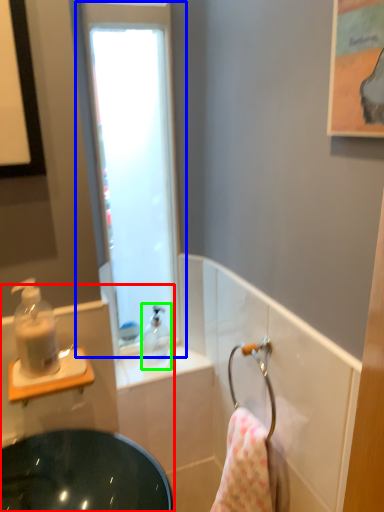
Question: Considering the real-world distances, which object is farthest from sink (highlighted by a red box)? window (highlighted by a blue box) or soap dispenser (highlighted by a green box)?

Choices:
 (A) window
 (B) soap dispenser

Answer: (A)